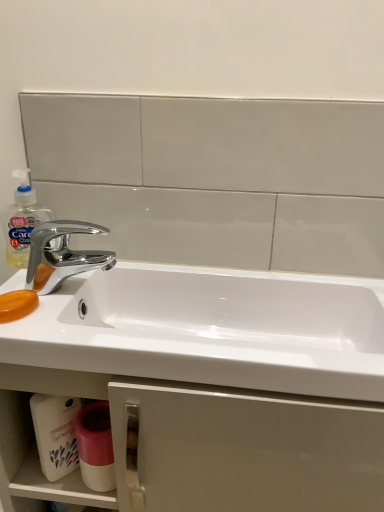
Question: Does orange translucent soap at left appear on the right side of white glossy cup at lower center?

Choices:
 (A) no
 (B) yes

Answer: (A)

Question: Does orange translucent soap at left have a lesser height compared to white glossy cup at lower center?

Choices:
 (A) yes
 (B) no

Answer: (A)

Question: From a real-world perspective, is orange translucent soap at left under white glossy cup at lower center?

Choices:
 (A) no
 (B) yes

Answer: (A)

Question: Could you tell me if orange translucent soap at left is facing white glossy cup at lower center?

Choices:
 (A) no
 (B) yes

Answer: (A)

Question: Is orange translucent soap at left far from white glossy cup at lower center?

Choices:
 (A) no
 (B) yes

Answer: (A)

Question: Would you say white glossy cup at lower center is part of orange translucent soap at left's contents?

Choices:
 (A) yes
 (B) no

Answer: (B)

Question: Is white glossy cup at lower center surrounding white matte cabinet at lower center?

Choices:
 (A) no
 (B) yes

Answer: (A)

Question: Can you confirm if white glossy cup at lower center is taller than white matte cabinet at lower center?

Choices:
 (A) no
 (B) yes

Answer: (A)

Question: Is white glossy cup at lower center not close to white matte cabinet at lower center?

Choices:
 (A) yes
 (B) no

Answer: (B)

Question: Is the depth of white glossy cup at lower center less than that of white matte cabinet at lower center?

Choices:
 (A) yes
 (B) no

Answer: (B)

Question: From the image's perspective, is white glossy cup at lower center on top of white matte cabinet at lower center?

Choices:
 (A) yes
 (B) no

Answer: (A)

Question: Does white glossy cup at lower center have a greater width compared to white matte cabinet at lower center?

Choices:
 (A) yes
 (B) no

Answer: (B)

Question: Can we say translucent plastic soap dispenser at left lies outside chrome/metallic faucet at left?

Choices:
 (A) no
 (B) yes

Answer: (B)